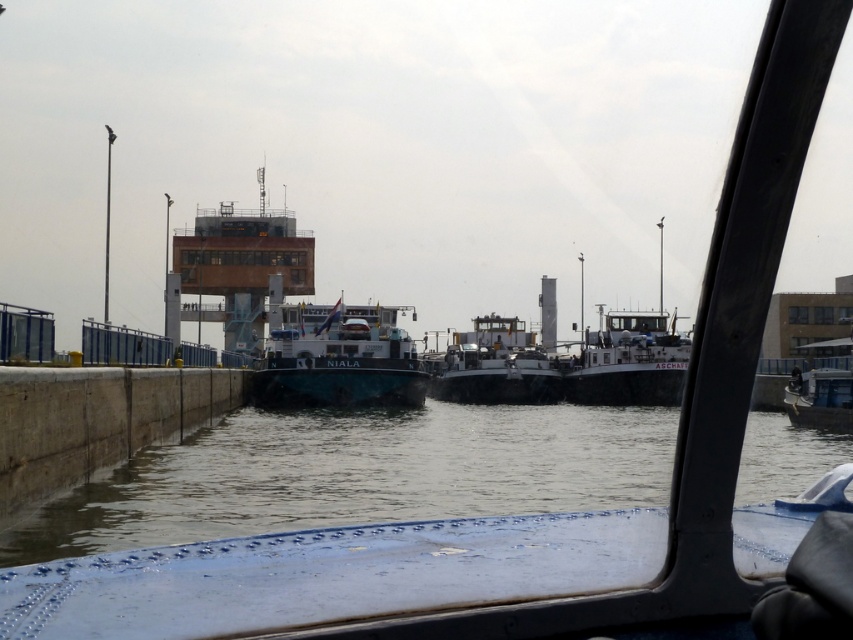
Question: Among these objects, which one is nearest to the camera?

Choices:
 (A) clear water at center
 (B) white matte barge at center

Answer: (A)

Question: Does clear water at center have a lesser width compared to white glossy barge at center?

Choices:
 (A) yes
 (B) no

Answer: (B)

Question: Can you confirm if clear water at center is positioned below white glossy barge at center?

Choices:
 (A) yes
 (B) no

Answer: (A)

Question: Which point is closer to the camera?

Choices:
 (A) (416, 445)
 (B) (526, 356)
 (C) (366, 388)

Answer: (A)

Question: Does white glossy barge at center appear under white matte barge at center?

Choices:
 (A) yes
 (B) no

Answer: (B)

Question: Which of the following is the closest to the observer?

Choices:
 (A) white glossy barge at center
 (B) white matte barge at center
 (C) clear water at center

Answer: (C)